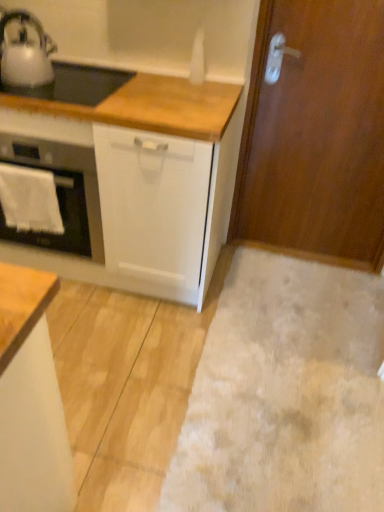
Measure the distance between point (18, 203) and camera.

Point (18, 203) and camera are 6.05 feet apart.

The image size is (384, 512). Describe the element at coordinates (25, 53) in the screenshot. I see `metallic silver kettle at upper left` at that location.

Find the location of a particular element. This screenshot has height=512, width=384. white matte cabinet at lower left is located at coordinates (30, 399).

At what (x,y) coordinates should I click in order to perform the action: click on wooden door at right. Please return your answer as a coordinate pair (x, y). Looking at the image, I should click on (316, 134).

In order to face beige carpet at lower right, should I rotate leftwards or rightwards?

Rotate right and turn 14.539 degrees.

In order to click on white towel at left in this screenshot , I will do `click(29, 200)`.

From the image's perspective, which is above, white matte cabinet at lower left or beige carpet at lower right?

beige carpet at lower right.

Considering the sizes of objects white matte cabinet at lower left and beige carpet at lower right in the image provided, who is wider, white matte cabinet at lower left or beige carpet at lower right?

Wider between the two is beige carpet at lower right.

From a real-world perspective, which object rests below the other?

beige carpet at lower right, from a real-world perspective.

Would you say white matte cabinet at lower left is inside or outside beige carpet at lower right?

white matte cabinet at lower left is outside beige carpet at lower right.

Does metallic silver kettle at upper left turn towards white towel at left?

No, metallic silver kettle at upper left is not facing towards white towel at left.

Is point (7, 16) closer or farther from the camera than point (23, 172)?

Point (7, 16) is farther from the camera than point (23, 172).

Choose the correct answer: Is metallic silver kettle at upper left inside white towel at left or outside it?

metallic silver kettle at upper left is outside white towel at left.

From a real-world perspective, between metallic silver kettle at upper left and white towel at left, who is vertically higher?

From a 3D spatial view, metallic silver kettle at upper left is above.

Between wooden door at right and metallic silver kettle at upper left, which one is positioned in front?

metallic silver kettle at upper left is more forward.

Between wooden door at right and metallic silver kettle at upper left, which one appears on the right side from the viewer's perspective?

Positioned to the right is wooden door at right.

Considering the relative sizes of wooden door at right and metallic silver kettle at upper left in the image provided, is wooden door at right wider than metallic silver kettle at upper left?

In fact, wooden door at right might be narrower than metallic silver kettle at upper left.

Are wooden door at right and metallic silver kettle at upper left making contact?

There is a gap between wooden door at right and metallic silver kettle at upper left.

Considering the sizes of objects wooden door at right and white glossy oven at left in the image provided, who is smaller, wooden door at right or white glossy oven at left?

wooden door at right is smaller.

From a real-world perspective, is wooden door at right physically located above or below white glossy oven at left?

From a real-world perspective, wooden door at right is physically above white glossy oven at left.

Can you confirm if white glossy oven at left is bigger than white matte cabinet at lower left?

Indeed, white glossy oven at left has a larger size compared to white matte cabinet at lower left.

Can you confirm if white glossy oven at left is shorter than white matte cabinet at lower left?

Yes, white glossy oven at left is shorter than white matte cabinet at lower left.

I want to click on home appliance behind the white matte cabinet at lower left, so click(61, 194).

From a real-world perspective, who is located higher, white glossy oven at left or white matte cabinet at lower left?

From a 3D spatial view, white matte cabinet at lower left is above.

Is wooden door at right placed right next to white matte cabinet at lower left?

There is a gap between wooden door at right and white matte cabinet at lower left.

Measure the distance between wooden door at right and white matte cabinet at lower left.

wooden door at right is 5.53 feet away from white matte cabinet at lower left.

Between wooden door at right and white matte cabinet at lower left, which one has more height?

With more height is wooden door at right.

Can you confirm if wooden door at right is positioned to the right of white matte cabinet at lower left?

Yes.

Would you say white glossy oven at left is a long distance from beige carpet at lower right?

No.

Which is in front, white glossy oven at left or beige carpet at lower right?

beige carpet at lower right.

From the picture: Between white glossy oven at left and beige carpet at lower right, which one has more height?

Standing taller between the two is white glossy oven at left.

Is white glossy oven at left oriented towards beige carpet at lower right?

No.

This screenshot has width=384, height=512. In order to click on cabinetry that appears on the left of beige carpet at lower right in this screenshot , I will do `click(30, 399)`.

The width and height of the screenshot is (384, 512). Identify the location of kitchen appliance above the white towel at left (from a real-world perspective). (25, 53).

Based on the photo, when comparing their distances from metallic silver kettle at upper left, does white glossy oven at left or wooden door at right seem closer?

white glossy oven at left lies closer to metallic silver kettle at upper left than the other object.

Which object lies further to the anchor point white towel at left, metallic silver kettle at upper left or beige carpet at lower right?

Among the two, beige carpet at lower right is located further to white towel at left.

When comparing their distances from wooden door at right, does metallic silver kettle at upper left or white towel at left seem further?

metallic silver kettle at upper left lies further to wooden door at right than the other object.

Looking at this image, from the image, which object appears to be farther from wooden door at right, metallic silver kettle at upper left or white matte cabinet at lower left?

white matte cabinet at lower left lies further to wooden door at right than the other object.

When comparing their distances from metallic silver kettle at upper left, does wooden door at right or beige carpet at lower right seem further?

beige carpet at lower right is further to metallic silver kettle at upper left.

Looking at the image, which one is located further to white towel at left, white matte cabinet at lower left or beige carpet at lower right?

beige carpet at lower right is positioned further to the anchor white towel at left.

Based on the photo, looking at the image, which one is located closer to beige carpet at lower right, white glossy oven at left or white matte cabinet at lower left?

Based on the image, white matte cabinet at lower left appears to be nearer to beige carpet at lower right.

Estimate the real-world distances between objects in this image. Which object is further from white towel at left, white matte cabinet at lower left or white glossy oven at left?

white matte cabinet at lower left.

Find the location of `plain between metallic silver kettle at upper left and wooden door at right`. plain between metallic silver kettle at upper left and wooden door at right is located at coordinates (285, 394).

I want to click on cabinetry between white glossy oven at left and wooden door at right, so pos(30,399).

I want to click on home appliance between metallic silver kettle at upper left and white matte cabinet at lower left from top to bottom, so click(x=61, y=194).

This screenshot has width=384, height=512. Identify the location of cabinetry between white towel at left and wooden door at right in the horizontal direction. (30, 399).